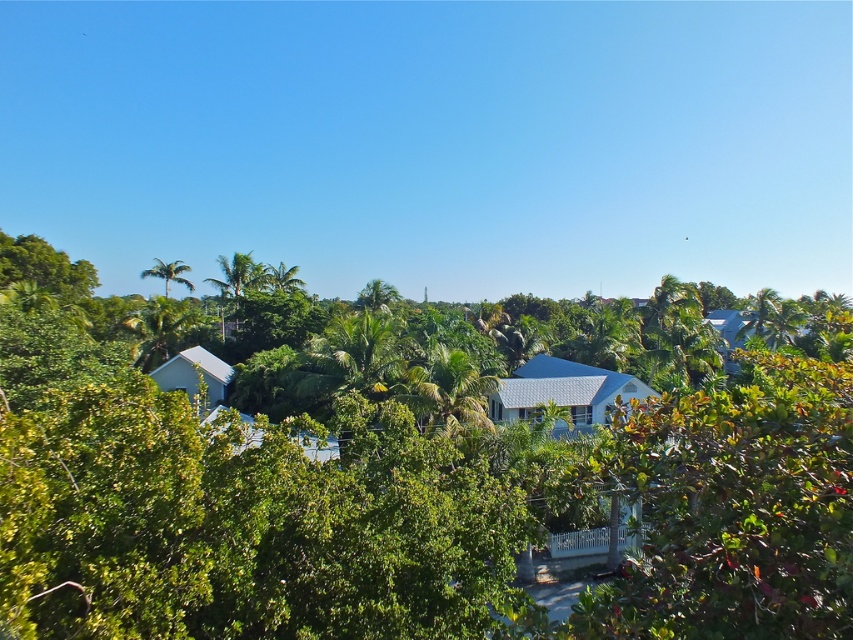
Between point (384, 317) and point (164, 291), which one is positioned in front?

Point (384, 317)

Is point (779, 465) positioned after point (164, 268)?

No, it is in front of (164, 268).

Is point (511, 592) positioned after point (177, 264)?

No, (511, 592) is in front of (177, 264).

Locate an element on the screen. green leafy tree at center is located at coordinates [x=405, y=506].